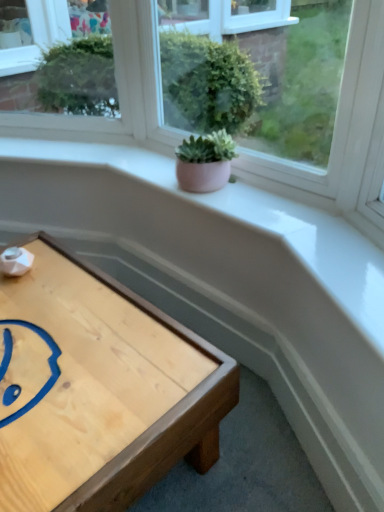
Locate an element on the screen. The height and width of the screenshot is (512, 384). vacant space situated above light wood/texture coffee table at lower left (from a real-world perspective) is located at coordinates (67, 338).